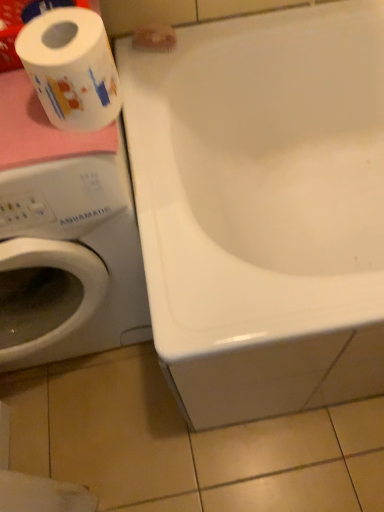
Question: Does white glossy bathtub at upper center contain white printed toilet paper at left, which is counted as the second toilet paper, starting from the top?

Choices:
 (A) yes
 (B) no

Answer: (B)

Question: Is white glossy bathtub at upper center bigger than white printed toilet paper at left, which is counted as the 2th toilet paper, starting from the back?

Choices:
 (A) no
 (B) yes

Answer: (B)

Question: From the image's perspective, does white glossy bathtub at upper center appear lower than white printed toilet paper at left, which is counted as the 2th toilet paper, starting from the back?

Choices:
 (A) no
 (B) yes

Answer: (B)

Question: Is white glossy bathtub at upper center outside of white printed toilet paper at left, which is counted as the 1th toilet paper, starting from the front?

Choices:
 (A) yes
 (B) no

Answer: (A)

Question: From a real-world perspective, is white glossy bathtub at upper center on white printed toilet paper at left, which is counted as the 2th toilet paper, starting from the back?

Choices:
 (A) no
 (B) yes

Answer: (A)

Question: Considering the relative positions of white glossy bathtub at upper center and white printed toilet paper at left, which is counted as the second toilet paper, starting from the top, in the image provided, is white glossy bathtub at upper center behind white printed toilet paper at left, which is counted as the second toilet paper, starting from the top,?

Choices:
 (A) yes
 (B) no

Answer: (A)

Question: From the image's perspective, is white printed toilet paper at left, which is counted as the 2th toilet paper, starting from the back, under white matte toilet paper at upper center, placed as the 1th toilet paper when sorted from back to front?

Choices:
 (A) yes
 (B) no

Answer: (A)

Question: Can you confirm if white printed toilet paper at left, marked as the 1th toilet paper in a bottom-to-top arrangement, is thinner than white matte toilet paper at upper center, the 2th toilet paper in the bottom-to-top sequence?

Choices:
 (A) yes
 (B) no

Answer: (B)

Question: Considering the relative sizes of white printed toilet paper at left, marked as the 1th toilet paper in a bottom-to-top arrangement, and white matte toilet paper at upper center, the 1th toilet paper from the top, in the image provided, is white printed toilet paper at left, marked as the 1th toilet paper in a bottom-to-top arrangement, shorter than white matte toilet paper at upper center, the 1th toilet paper from the top,?

Choices:
 (A) yes
 (B) no

Answer: (B)

Question: Does white printed toilet paper at left, which is counted as the 1th toilet paper, starting from the front, lie in front of white matte toilet paper at upper center, the 1th toilet paper from the top?

Choices:
 (A) yes
 (B) no

Answer: (A)

Question: Would you say white printed toilet paper at left, which is counted as the 1th toilet paper, starting from the front, contains white matte toilet paper at upper center, arranged as the second toilet paper when viewed from the front?

Choices:
 (A) no
 (B) yes

Answer: (A)

Question: From a real-world perspective, is white printed toilet paper at left, which is counted as the second toilet paper, starting from the top, below white glossy bathtub at upper center?

Choices:
 (A) yes
 (B) no

Answer: (B)